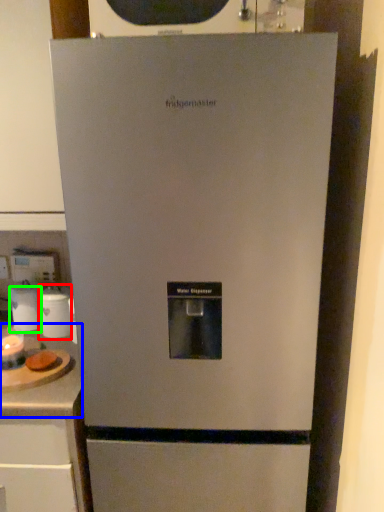
Question: Based on their relative distances, which object is nearer to appliance (highlighted by a red box)? Choose from counter top (highlighted by a blue box) and appliance (highlighted by a green box).

Choices:
 (A) counter top
 (B) appliance

Answer: (B)